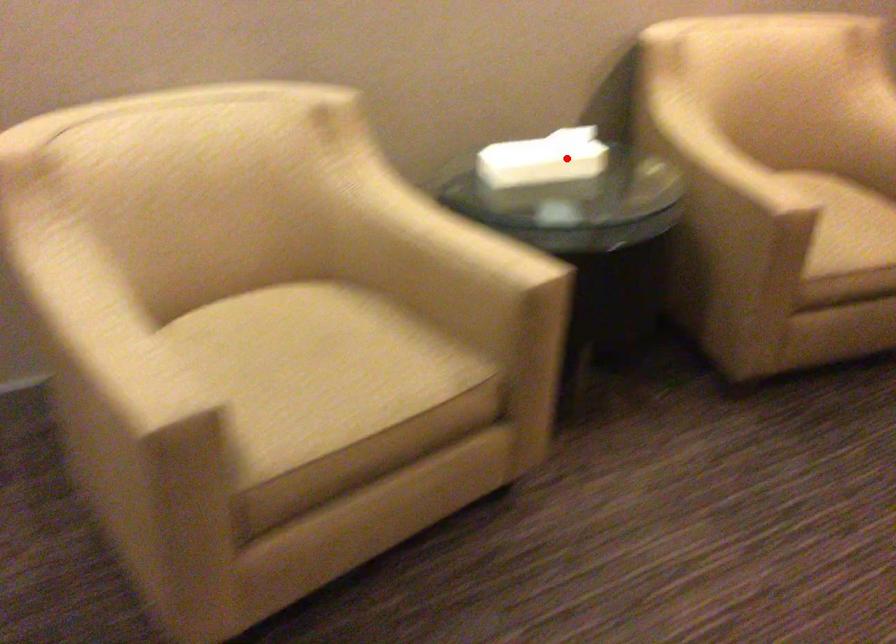
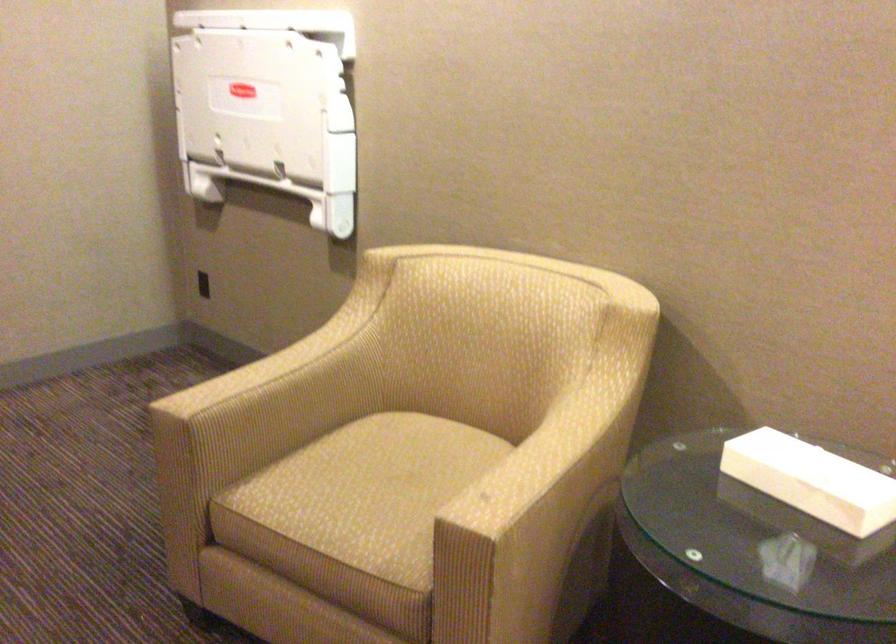
Where in the second image is the point corresponding to the highlighted location from the first image?

(812, 480)